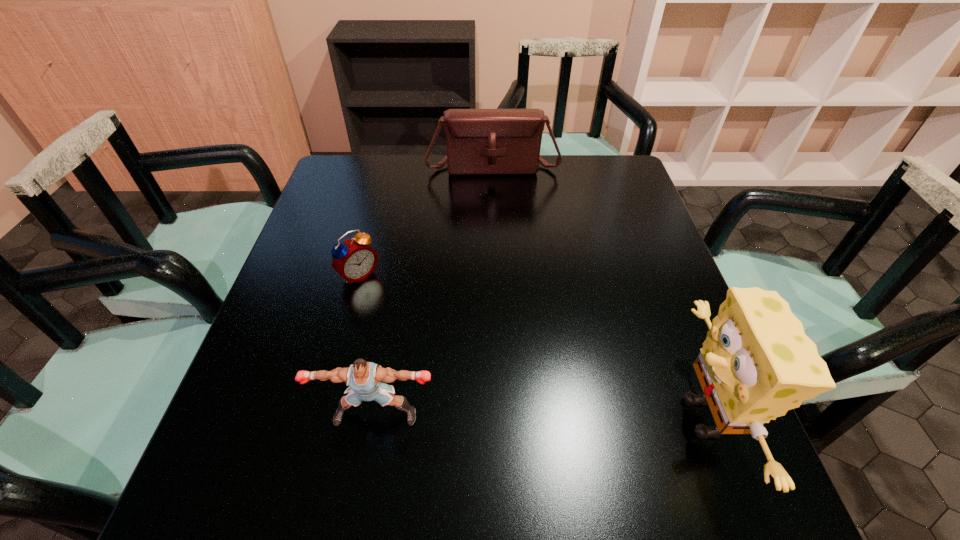
At what (x,y) coordinates should I click in order to perform the action: click on puncher. Please return your answer as a coordinate pair (x, y). The image size is (960, 540). Looking at the image, I should click on (364, 378).

The width and height of the screenshot is (960, 540). I want to click on sponge, so click(756, 363).

The image size is (960, 540). In order to click on the tallest object in this screenshot , I will do `click(756, 363)`.

Find the location of a particular element. The image size is (960, 540). alarm clock is located at coordinates (354, 260).

Identify the location of the shortest object. (354, 260).

Identify the location of shoulder bag. (479, 141).

This screenshot has height=540, width=960. I want to click on free space located 0.110m on the face of the rightmost object, so click(x=609, y=417).

Identify the location of vacant space positioned on the face of the rightmost object. The width and height of the screenshot is (960, 540). coord(543,417).

Identify the location of blank space located on the face of the rightmost object. Image resolution: width=960 pixels, height=540 pixels. (636, 417).

At what (x,y) coordinates should I click in order to perform the action: click on vacant point located on the front-facing side of the second farthest object. Please return your answer as a coordinate pair (x, y). The width and height of the screenshot is (960, 540). Looking at the image, I should click on (415, 330).